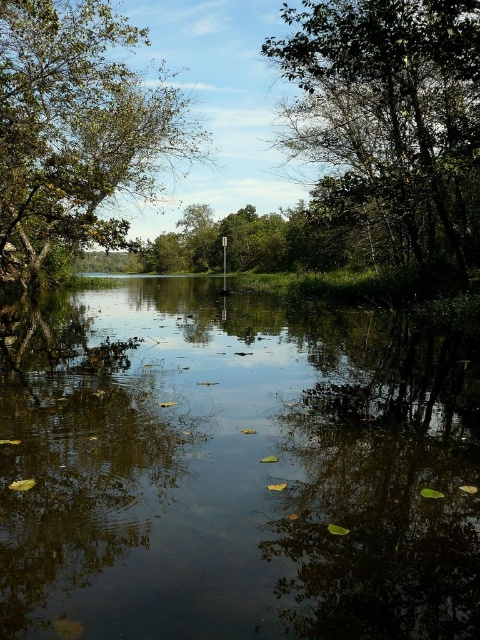
Consider the image. You are a bird flying over the flooded area. You see the dark reflective water at center and the green leafy tree at upper left. Which one is closer to the ground?

The dark reflective water at center is below green leafy tree at upper left, so the dark reflective water at center is closer to the ground.